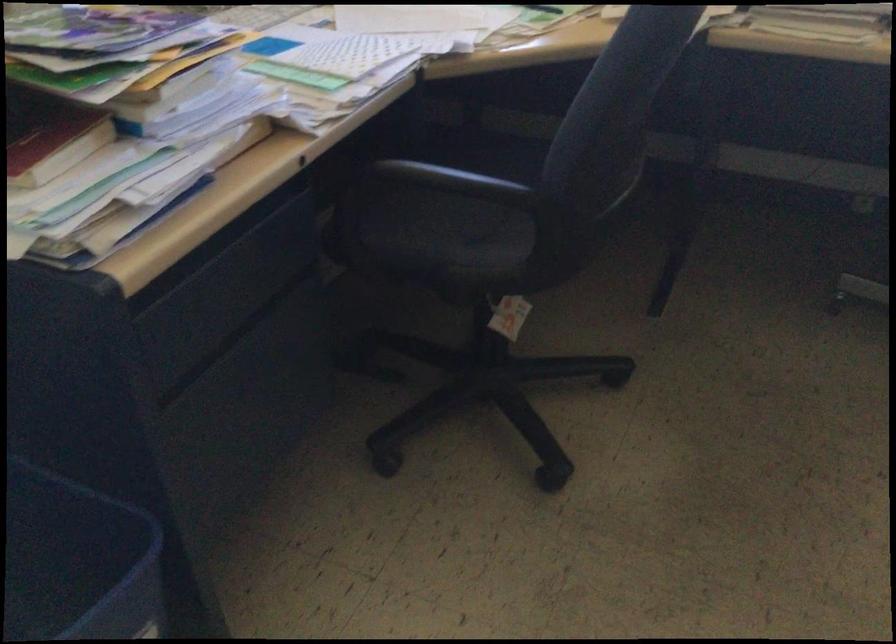
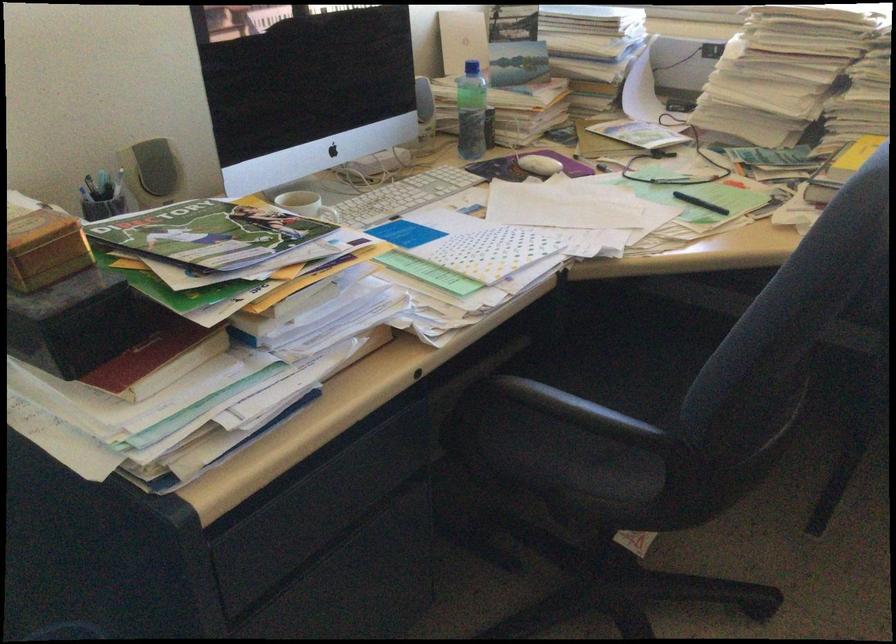
Find the pixel in the second image that matches [210,272] in the first image.

(300, 491)